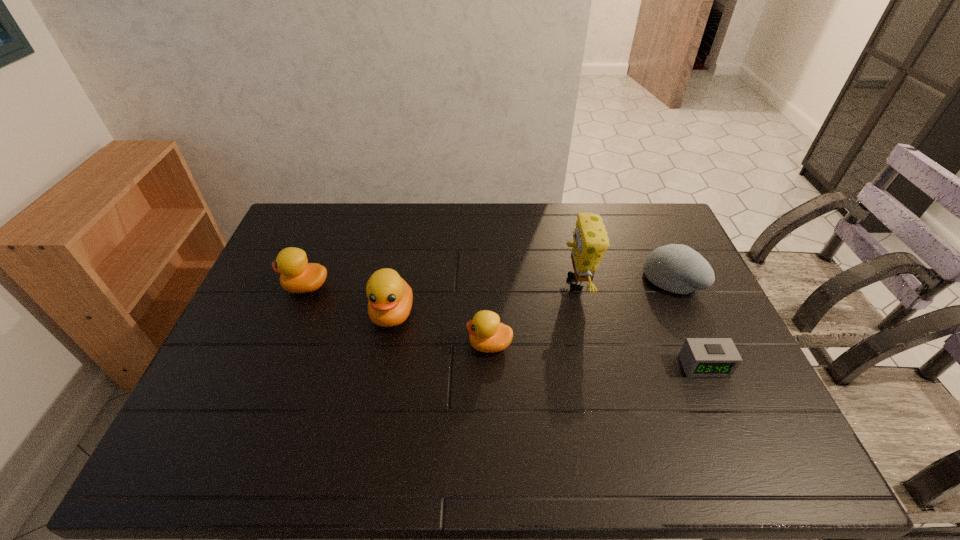
Please point a spot to add another duckling on the right. Please provide its 2D coordinates. Your answer should be formatted as a tuple, i.e. [(x, y)], where the tuple contains the x and y coordinates of a point satisfying the conditions above.

[(601, 380)]